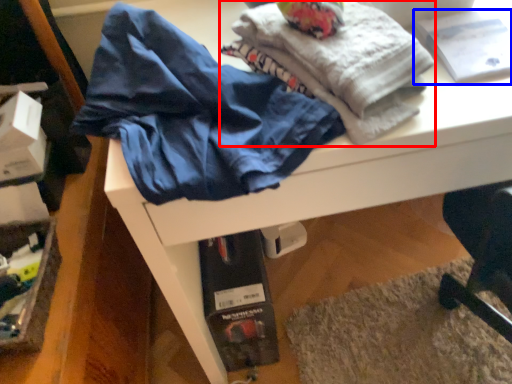
Question: Among these objects, which one is farthest to the camera, fabric (highlighted by a red box) or book (highlighted by a blue box)?

Choices:
 (A) fabric
 (B) book

Answer: (B)